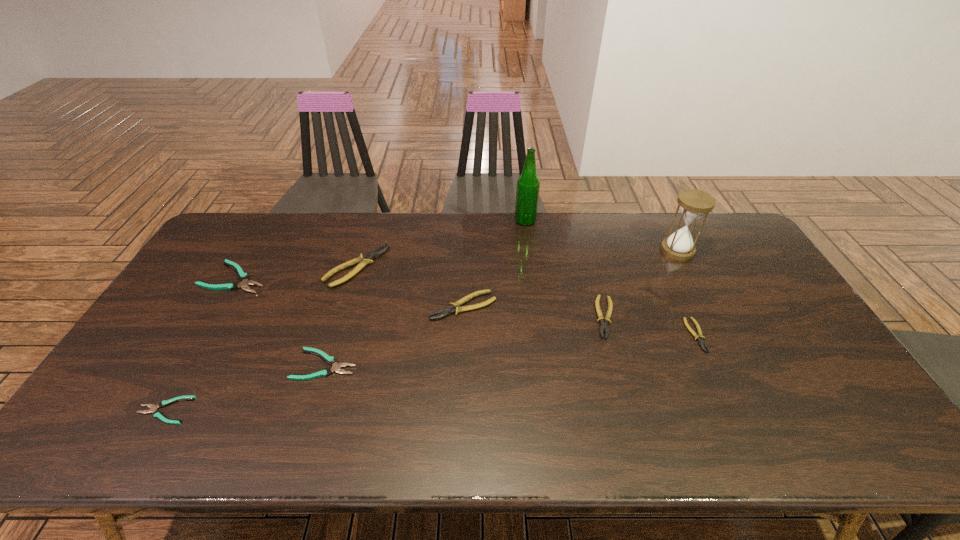
The width and height of the screenshot is (960, 540). I want to click on free space that is in between the second yellow pliers from left to right and the rightmost pliers, so click(x=580, y=321).

The height and width of the screenshot is (540, 960). I want to click on vacant point located between the shortest object and the second tallest object, so click(x=420, y=330).

The width and height of the screenshot is (960, 540). Identify the location of empty space between the second yellow pliers from right to left and the sixth shortest object. (535, 312).

Locate an element on the screen. This screenshot has width=960, height=540. free area in between the nearest teal pliers and the second pliers from right to left is located at coordinates (385, 364).

Find the location of a particular element. vacant space that's between the tallest pliers and the second farthest teal pliers is located at coordinates (341, 315).

You are a GUI agent. You are given a task and a screenshot of the screen. Output one action in this format:
    pyautogui.click(x=<x>, y=<y>)
    Task: Click on the free space between the farthest yellow pliers and the white hourglass
    
    Given the screenshot: What is the action you would take?
    pyautogui.click(x=517, y=259)

The height and width of the screenshot is (540, 960). In order to click on vacant space that's between the biggest teal pliers and the second pliers from right to left in this screenshot , I will do `click(420, 298)`.

The width and height of the screenshot is (960, 540). Find the location of `unoccupied area between the second tallest pliers and the beer bottle`. unoccupied area between the second tallest pliers and the beer bottle is located at coordinates (494, 264).

What are the coordinates of `the eighth closest object to the hourglass` in the screenshot? It's located at (153, 408).

Identify which object is the third nearest to the hourglass. Please provide its 2D coordinates. Your answer should be formatted as a tuple, i.e. [(x, y)], where the tuple contains the x and y coordinates of a point satisfying the conditions above.

[(528, 184)]